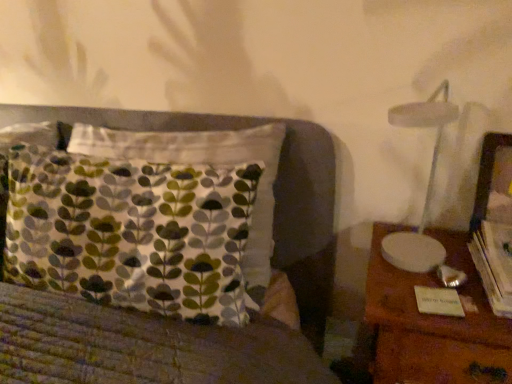
Find the location of `free spot above wooden nightstand at right (from a real-world perspective)`. free spot above wooden nightstand at right (from a real-world perspective) is located at coordinates (426, 263).